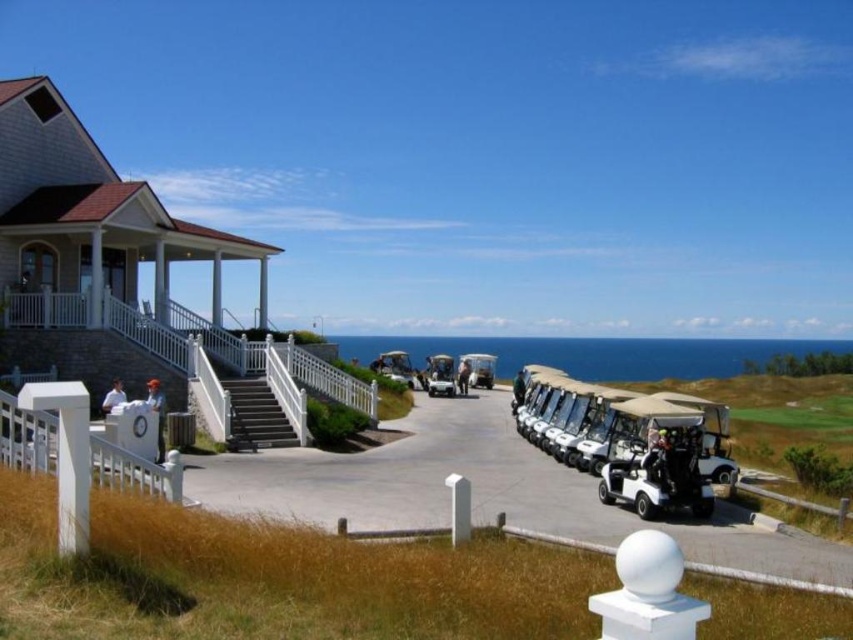
You are a golfer standing at the bottom of the smooth concrete stairs at center and want to reach the matte black golf cart at center. Which direction should you move to get there?

The smooth concrete stairs at center is located above the matte black golf cart at center, so you should move downward to reach the matte black golf cart at center.

You are standing at the entrance of the two story building with a white exterior and a red tiled roof on the left side of the image. You want to go to the paved area leading towards the ocean where the golf carts are parked. Which direction should you walk relative to the smooth concrete stairs at center?

You should walk away from the smooth concrete stairs at center because the stairs lead upwards to the entrance, while the paved area towards the ocean is likely located in the opposite direction.

You are standing at the two story building with white exterior and red tiled roof on the left side of the image. You want to go to the point at coordinates [256,416]. Which direction should you walk to reach the point?

You should walk towards the center of the image because the point at coordinates [256,416] is located on smooth concrete stairs at center.